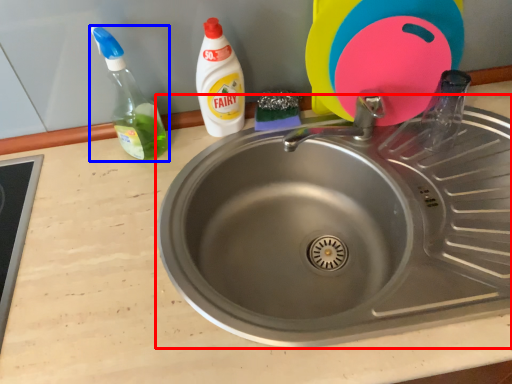
Question: Which object appears farthest to the camera in this image, sink (highlighted by a red box) or bottle (highlighted by a blue box)?

Choices:
 (A) sink
 (B) bottle

Answer: (B)